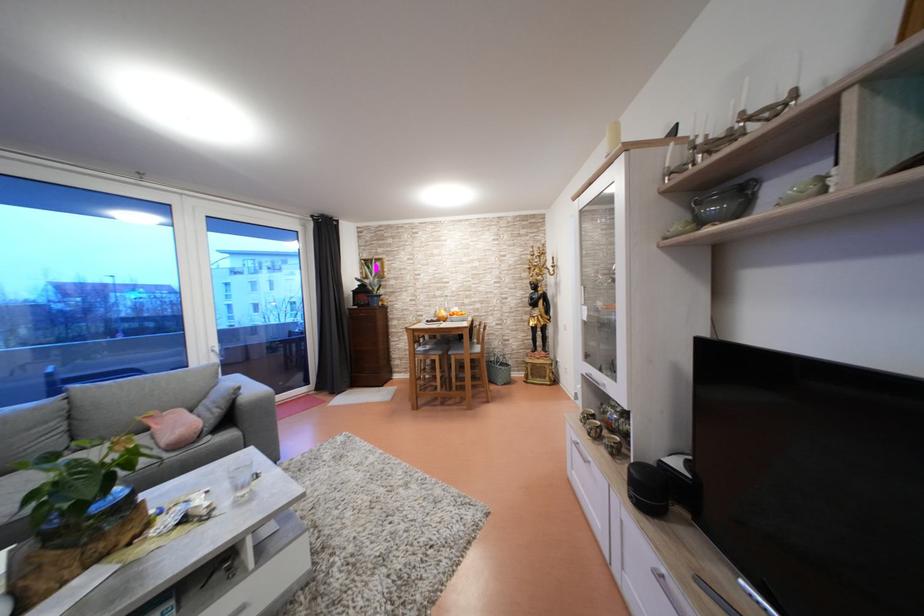
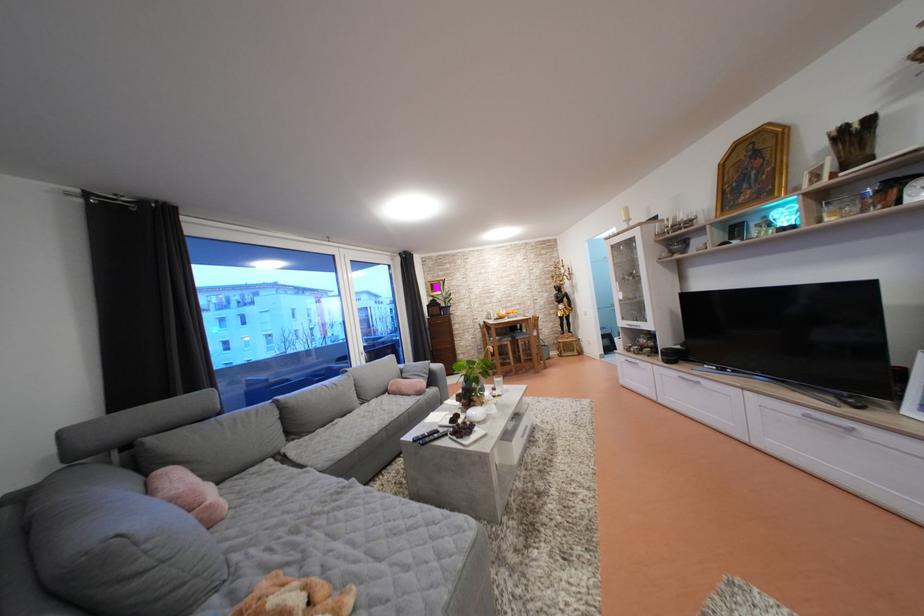
Find the pixel in the second image that matches the point at 407,363 in the first image.

(470, 359)